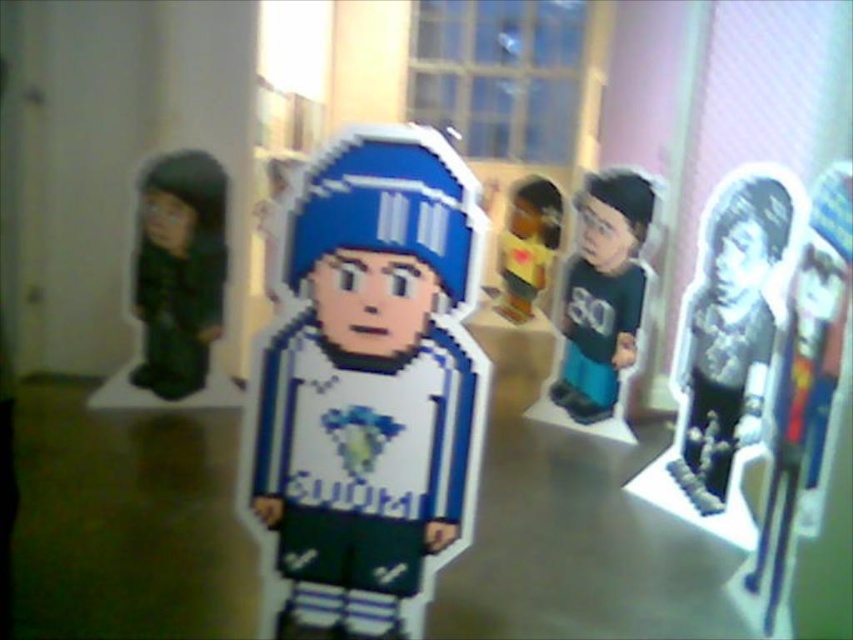
Question: Which of the following is the closest to the observer?

Choices:
 (A) (154, 276)
 (B) (561, 301)
 (C) (740, 433)

Answer: (C)

Question: Which point is closer to the camera taking this photo?

Choices:
 (A) (705, 276)
 (B) (527, 312)
 (C) (627, 262)
 (D) (335, 625)

Answer: (D)

Question: Does pixelated blue and white figure at center appear on the left side of matte black doll at left?

Choices:
 (A) no
 (B) yes

Answer: (A)

Question: Which object is the closest to the white glossy paper cutout at center?

Choices:
 (A) matte black doll at left
 (B) matte yellow toy at center

Answer: (A)

Question: Is pixelated blue and white figure at center closer to the viewer compared to white glossy paper cutout at center?

Choices:
 (A) no
 (B) yes

Answer: (B)

Question: From the image, what is the correct spatial relationship of white glossy paper cutout at center in relation to matte green jersey at center?

Choices:
 (A) left
 (B) right

Answer: (B)